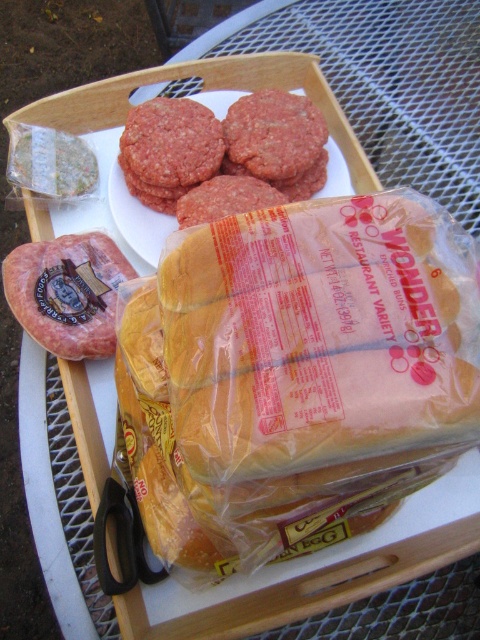
You are a chef preparing burgers and see the yellow soft bread at center and the ground beef patty at center on the tray. Which item is located below the other?

The yellow soft bread at center is positioned under the ground beef patty at center.